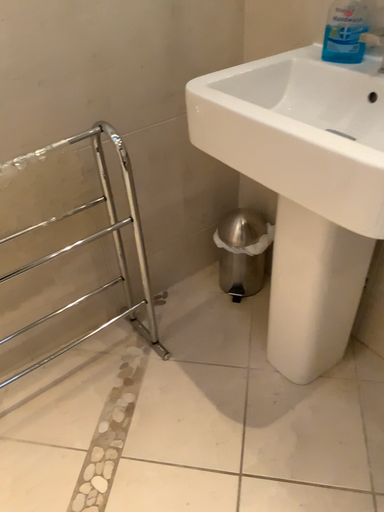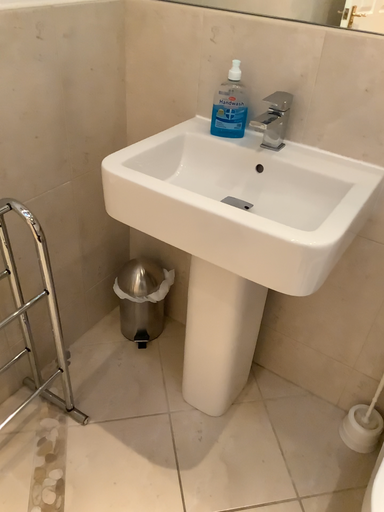
Question: How did the camera likely rotate when shooting the video?

Choices:
 (A) rotated right
 (B) rotated left

Answer: (A)